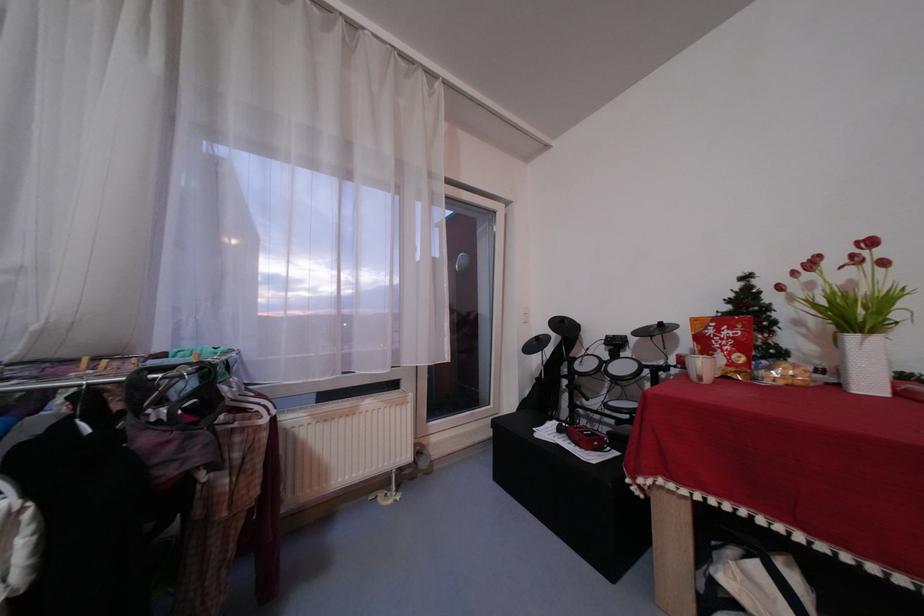
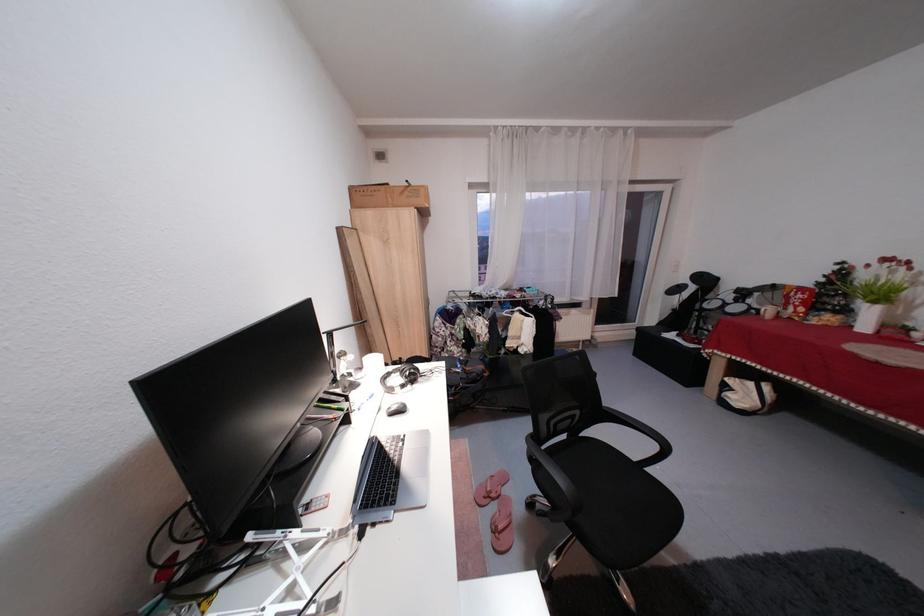
Where in the second image is the point corresponding to point 769,562 from the first image?

(764, 384)